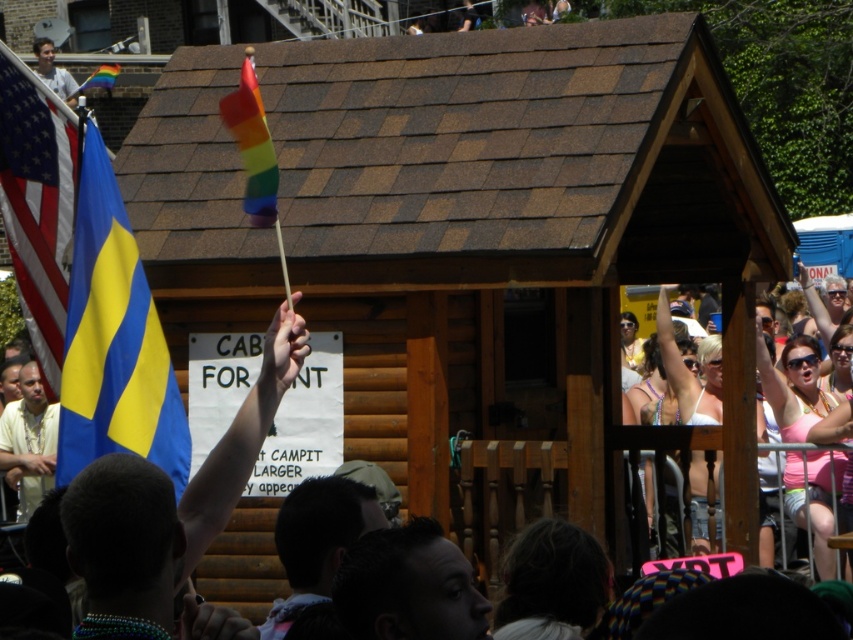
Is brown wooden hut at center thinner than matte white shirt at upper left?

In fact, brown wooden hut at center might be wider than matte white shirt at upper left.

Who is lower down, brown wooden hut at center or matte white shirt at upper left?

brown wooden hut at center

You are a GUI agent. You are given a task and a screenshot of the screen. Output one action in this format:
    pyautogui.click(x=<x>, y=<y>)
    Task: Click on the brown wooden hut at center
    The image size is (853, 640).
    Given the screenshot: What is the action you would take?
    pyautogui.click(x=506, y=225)

Is american flag at left smaller than rainbow fabric flag at upper left?

Yes, american flag at left is smaller than rainbow fabric flag at upper left.

Between american flag at left and rainbow fabric flag at upper left, which one appears on the right side from the viewer's perspective?

american flag at left

Where is `american flag at left`? american flag at left is located at coordinates (38, 204).

From the picture: Is blue/yellow fabric flag at left bigger than rainbow fabric flag at upper left?

Yes, blue/yellow fabric flag at left is bigger than rainbow fabric flag at upper left.

Does blue/yellow fabric flag at left come behind rainbow fabric flag at upper left?

That is False.

Does point (102, 294) lie behind point (99, 67)?

No, it is in front of (99, 67).

The image size is (853, 640). What are the coordinates of `blue/yellow fabric flag at left` in the screenshot? It's located at (113, 340).